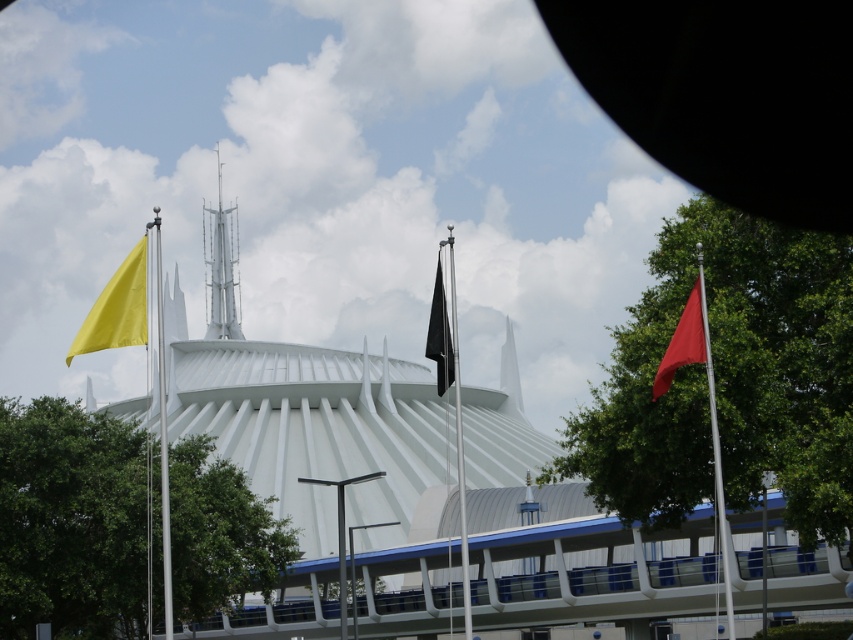
Question: Where is red fabric flag at right located in relation to red matte flag at right in the image?

Choices:
 (A) below
 (B) above

Answer: (A)

Question: Where is yellow matte flag at left located in relation to red matte flag at right in the image?

Choices:
 (A) below
 (B) above

Answer: (B)

Question: From the image, what is the correct spatial relationship of white metallic spire at center in relation to black matte flag at center?

Choices:
 (A) right
 (B) left

Answer: (B)

Question: Estimate the real-world distances between objects in this image. Which object is farther from the red matte flag at right?

Choices:
 (A) white metallic spire at center
 (B) black matte flag at center
 (C) black fabric flag at center
 (D) yellow matte flag at left

Answer: (A)

Question: Considering the real-world distances, which object is farthest from the red fabric flag at right?

Choices:
 (A) white metallic spire at center
 (B) red matte flag at right

Answer: (A)

Question: Which object is farther from the camera taking this photo?

Choices:
 (A) red fabric flag at right
 (B) yellow matte flag at left
 (C) white smooth spire at center

Answer: (C)